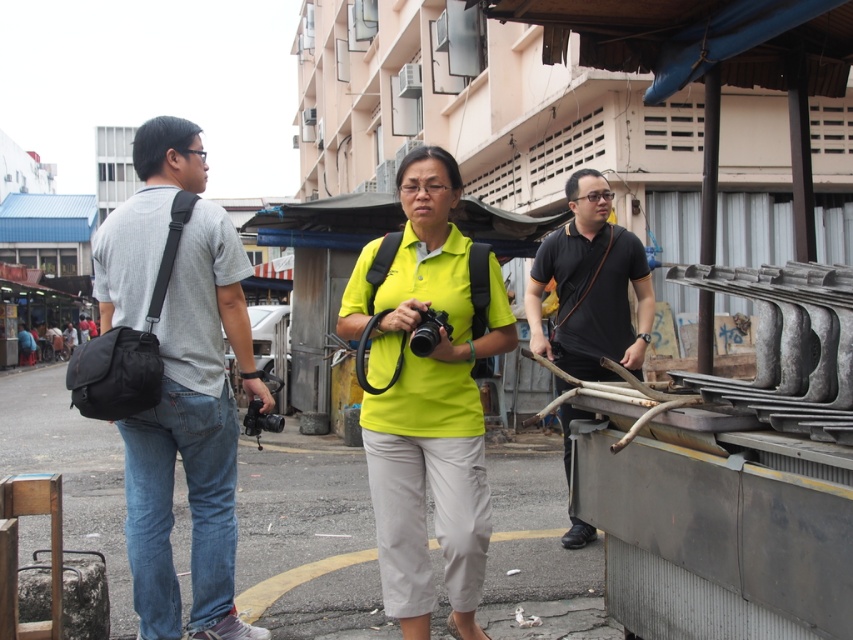
Question: Estimate the real-world distances between objects in this image. Which object is closer to the gray cotton t-shirt at left?

Choices:
 (A) black matte shirt at right
 (B) black plastic video camera at center
 (C) black plastic camera at center

Answer: (B)

Question: Which object appears closest to the camera in this image?

Choices:
 (A) black matte shirt at right
 (B) black plastic video camera at center
 (C) gray cotton t-shirt at left
 (D) black plastic camera at center

Answer: (D)

Question: Which point is closer to the camera?

Choices:
 (A) black plastic video camera at center
 (B) black matte shirt at right
 (C) neon yellow fabric at center

Answer: (C)

Question: Is neon yellow fabric at center wider than black plastic camera at center?

Choices:
 (A) yes
 (B) no

Answer: (A)

Question: Can you confirm if black plastic camera at center is bigger than black plastic video camera at center?

Choices:
 (A) yes
 (B) no

Answer: (B)

Question: Does gray cotton t-shirt at left lie behind black matte shirt at right?

Choices:
 (A) yes
 (B) no

Answer: (B)